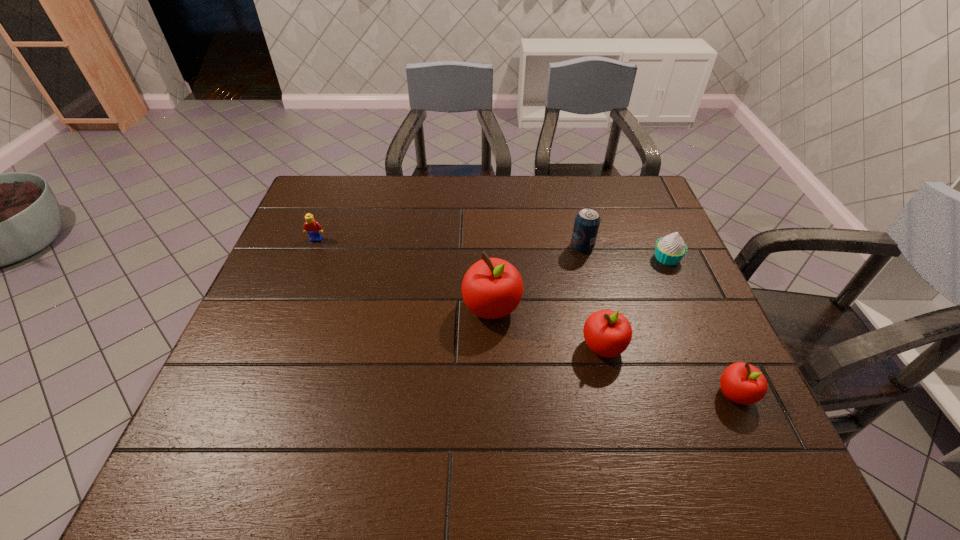
Identify the location of vacant spot to place a apple on the left. This screenshot has height=540, width=960. (396, 274).